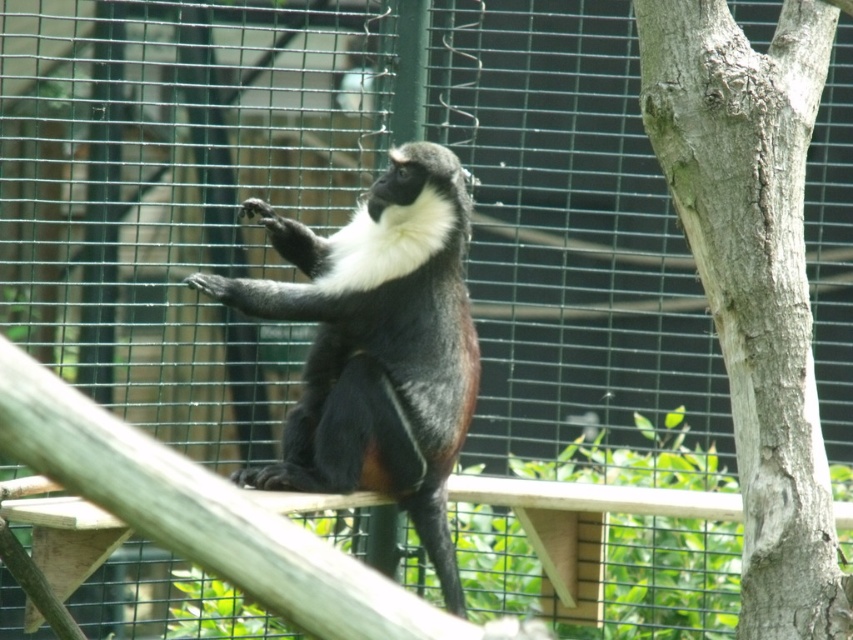
Does smooth gray bark at right have a smaller size compared to shiny black fur monkey at center?

Indeed, smooth gray bark at right has a smaller size compared to shiny black fur monkey at center.

Does point (741, 282) come in front of point (352, 282)?

That is True.

Image resolution: width=853 pixels, height=640 pixels. I want to click on smooth gray bark at right, so click(753, 278).